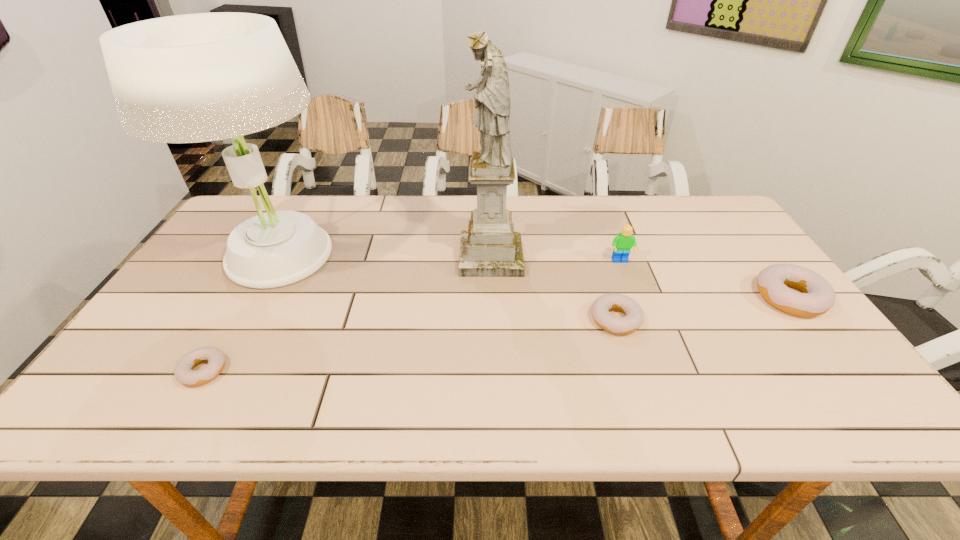
At what (x,y) coordinates should I click in order to perform the action: click on empty location between the nearest doughnut and the rightmost object. Please return your answer as a coordinate pair (x, y). Looking at the image, I should click on (497, 334).

I want to click on free space that is in between the second doughnut from right to left and the nearest doughnut, so click(410, 345).

In order to click on free space between the fourth shortest object and the second tallest doughnut in this screenshot , I will do `click(618, 291)`.

Find the location of a particular element. The image size is (960, 540). vacant point located between the Lego and the shortest object is located at coordinates (412, 316).

Identify the location of free space between the lamp and the nearest doughnut. (240, 314).

Locate an element on the screen. blank region between the lamp and the second shortest doughnut is located at coordinates (446, 288).

Where is `free space between the rightmost doughnut and the third object from left to right`? This screenshot has height=540, width=960. free space between the rightmost doughnut and the third object from left to right is located at coordinates (640, 277).

Find the location of a particular element. The height and width of the screenshot is (540, 960). free space between the leftmost doughnut and the Lego is located at coordinates (412, 316).

Identify which object is the fifth nearest to the leftmost doughnut. Please provide its 2D coordinates. Your answer should be formatted as a tuple, i.e. [(x, y)], where the tuple contains the x and y coordinates of a point satisfying the conditions above.

[(818, 296)]

Locate an element on the screen. object that is the fifth closest to the nearest doughnut is located at coordinates (818, 296).